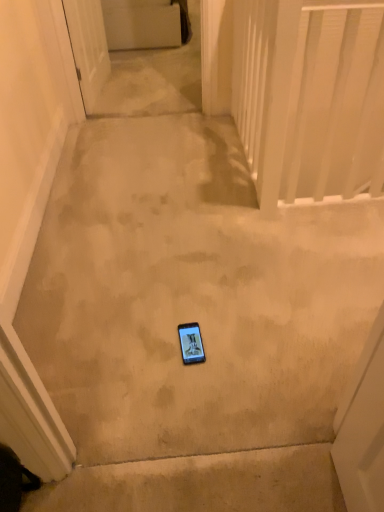
Identify the location of vacant space that is in between white plastic balustrade at upper right and matte black phone at center. The height and width of the screenshot is (512, 384). (254, 274).